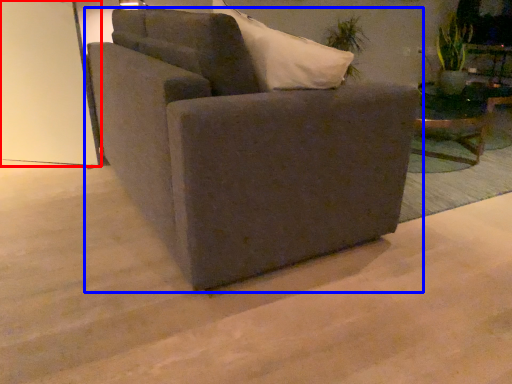
Question: Which object appears farthest to the camera in this image, glass door (highlighted by a red box) or chair (highlighted by a blue box)?

Choices:
 (A) glass door
 (B) chair

Answer: (A)